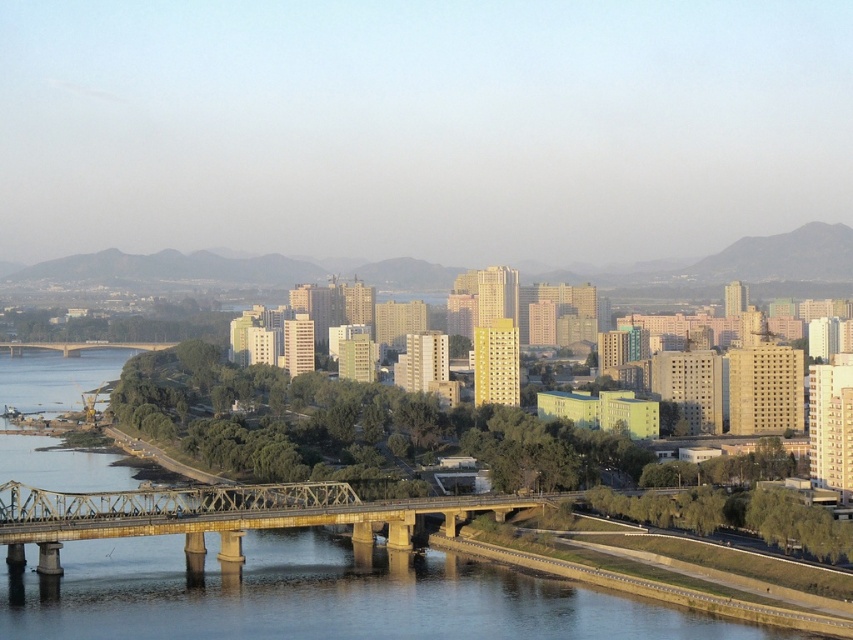
You are a drone operator tasked with capturing aerial footage of the city. Your drone is currently hovering at point coordinates 0.5, 0.5. You need to fly it to the golden metallic bridge at center to capture its structure. Which direction should you move the drone to reach the bridge?

The golden metallic bridge at center is located at point coordinates [216,515]. Since the drone is at [426,320], you should move the drone to the right and down to reach the bridge.

You are a city planner assessing the space between the golden metallic bridge at center and the brown metallic bridge at center. Given that the minimum required distance for a new pedestrian walkway is 250 feet, can the walkway be safely constructed between them?

The distance between the golden metallic bridge at center and the brown metallic bridge at center is 263.23 feet, which exceeds the 250 feet requirement. Therefore, the pedestrian walkway can be safely constructed between them.

You are an architect analyzing the cityscape. You notice two bridges in the image. Which bridge, the golden metallic bridge at center or the brown metallic bridge at center, is closer to the viewer?

The golden metallic bridge at center is closer to the viewer because it is in front of the brown metallic bridge at center.